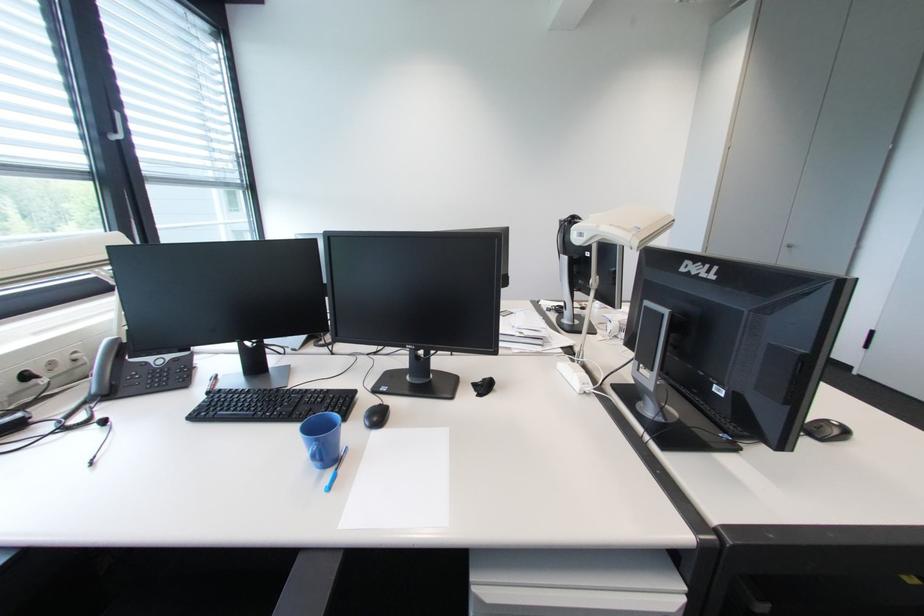
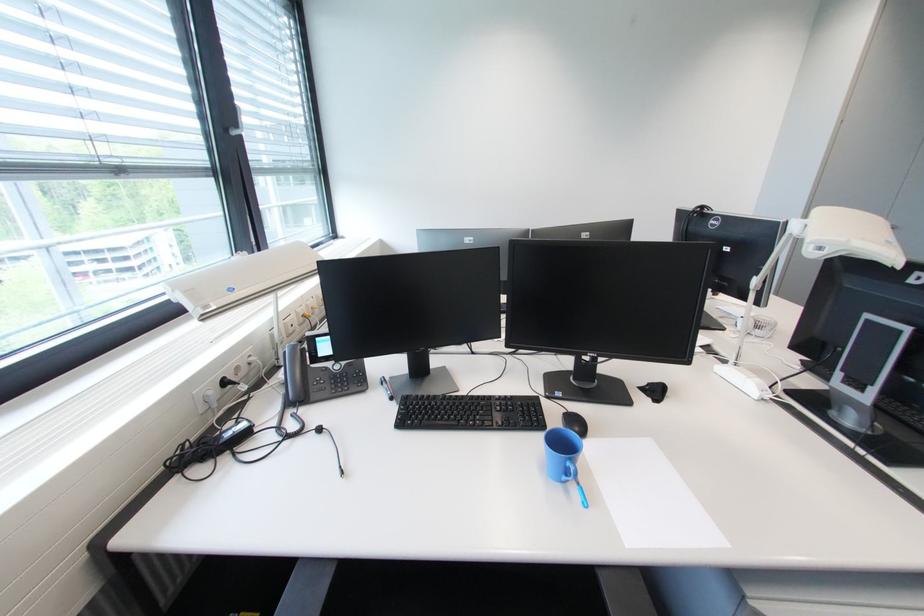
Locate, in the second image, the point that corresponds to the point at 335,475 in the first image.

(579, 488)